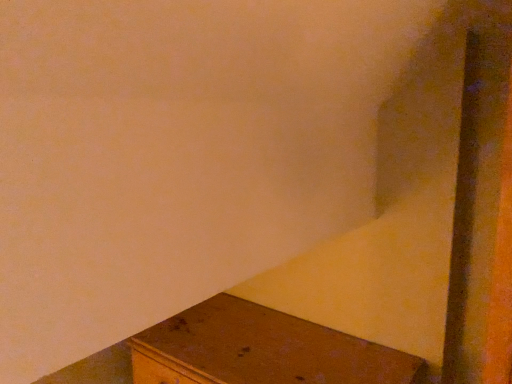
The width and height of the screenshot is (512, 384). What are the coordinates of `wooden chest at lower left` in the screenshot? It's located at point(261,350).

The image size is (512, 384). Describe the element at coordinates (261, 350) in the screenshot. I see `wooden chest at lower left` at that location.

Where is `wooden chest at lower left`? This screenshot has height=384, width=512. wooden chest at lower left is located at coordinates (261, 350).